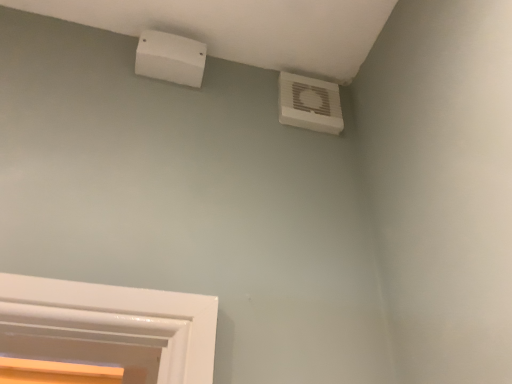
The height and width of the screenshot is (384, 512). Describe the element at coordinates (170, 58) in the screenshot. I see `white plastic air conditioning at upper left, which appears as the 1th air conditioning when viewed from the left` at that location.

Where is `white plastic air conditioning at upper left, which is the 2th air conditioning in right-to-left order`? Image resolution: width=512 pixels, height=384 pixels. white plastic air conditioning at upper left, which is the 2th air conditioning in right-to-left order is located at coordinates (170, 58).

Measure the distance between white plastic air conditioning at upper left, which is the 2th air conditioning in right-to-left order, and camera.

white plastic air conditioning at upper left, which is the 2th air conditioning in right-to-left order, and camera are 92.25 centimeters apart from each other.

The height and width of the screenshot is (384, 512). What do you see at coordinates (309, 104) in the screenshot?
I see `white plastic air conditioning unit at upper right, positioned as the second air conditioning in left-to-right order` at bounding box center [309, 104].

At what (x,y) coordinates should I click in order to perform the action: click on white plastic air conditioning unit at upper right, positioned as the second air conditioning in left-to-right order. Please return your answer as a coordinate pair (x, y). The height and width of the screenshot is (384, 512). Looking at the image, I should click on (309, 104).

The width and height of the screenshot is (512, 384). In order to click on white plastic air conditioning at upper left, which appears as the 1th air conditioning when viewed from the left in this screenshot , I will do `click(170, 58)`.

Considering the positions of objects white plastic air conditioning unit at upper right, positioned as the second air conditioning in left-to-right order, and white plastic air conditioning at upper left, which is the 2th air conditioning in right-to-left order, in the image provided, who is more to the right, white plastic air conditioning unit at upper right, positioned as the second air conditioning in left-to-right order, or white plastic air conditioning at upper left, which is the 2th air conditioning in right-to-left order,?

From the viewer's perspective, white plastic air conditioning unit at upper right, positioned as the second air conditioning in left-to-right order, appears more on the right side.

Relative to white plastic air conditioning at upper left, which appears as the 1th air conditioning when viewed from the left, is white plastic air conditioning unit at upper right, which is the 1th air conditioning from right to left, in front or behind?

In the image, white plastic air conditioning unit at upper right, which is the 1th air conditioning from right to left, appears behind white plastic air conditioning at upper left, which appears as the 1th air conditioning when viewed from the left.

In the scene shown: Which is less distant, (282,105) or (159,39)?

The point (159,39) is closer to the camera.

From the image's perspective, is white plastic air conditioning unit at upper right, positioned as the second air conditioning in left-to-right order, under white plastic air conditioning at upper left, which is the 2th air conditioning in right-to-left order?

Indeed, from the image's perspective, white plastic air conditioning unit at upper right, positioned as the second air conditioning in left-to-right order, is shown beneath white plastic air conditioning at upper left, which is the 2th air conditioning in right-to-left order.

From a real-world perspective, is white plastic air conditioning unit at upper right, which is the 1th air conditioning from right to left, physically located above or below white plastic air conditioning at upper left, which is the 2th air conditioning in right-to-left order?

In terms of real-world spatial position, white plastic air conditioning unit at upper right, which is the 1th air conditioning from right to left, is below white plastic air conditioning at upper left, which is the 2th air conditioning in right-to-left order.

Based on the photo, considering the relative sizes of white plastic air conditioning unit at upper right, which is the 1th air conditioning from right to left, and white plastic air conditioning at upper left, which is the 2th air conditioning in right-to-left order, in the image provided, is white plastic air conditioning unit at upper right, which is the 1th air conditioning from right to left, wider than white plastic air conditioning at upper left, which is the 2th air conditioning in right-to-left order,?

In fact, white plastic air conditioning unit at upper right, which is the 1th air conditioning from right to left, might be narrower than white plastic air conditioning at upper left, which is the 2th air conditioning in right-to-left order.

Considering the sizes of objects white plastic air conditioning unit at upper right, which is the 1th air conditioning from right to left, and white plastic air conditioning at upper left, which is the 2th air conditioning in right-to-left order, in the image provided, who is shorter, white plastic air conditioning unit at upper right, which is the 1th air conditioning from right to left, or white plastic air conditioning at upper left, which is the 2th air conditioning in right-to-left order,?

white plastic air conditioning at upper left, which is the 2th air conditioning in right-to-left order.

Considering the relative sizes of white plastic air conditioning unit at upper right, which is the 1th air conditioning from right to left, and white plastic air conditioning at upper left, which is the 2th air conditioning in right-to-left order, in the image provided, is white plastic air conditioning unit at upper right, which is the 1th air conditioning from right to left, bigger than white plastic air conditioning at upper left, which is the 2th air conditioning in right-to-left order,?

Incorrect, white plastic air conditioning unit at upper right, which is the 1th air conditioning from right to left, is not larger than white plastic air conditioning at upper left, which is the 2th air conditioning in right-to-left order.

Based on the photo, is white plastic air conditioning at upper left, which appears as the 1th air conditioning when viewed from the left, inside white plastic air conditioning unit at upper right, positioned as the second air conditioning in left-to-right order?

No.

Are white plastic air conditioning unit at upper right, positioned as the second air conditioning in left-to-right order, and white plastic air conditioning at upper left, which is the 2th air conditioning in right-to-left order, far apart?

white plastic air conditioning unit at upper right, positioned as the second air conditioning in left-to-right order, is actually quite close to white plastic air conditioning at upper left, which is the 2th air conditioning in right-to-left order.

Could you tell me if white plastic air conditioning unit at upper right, which is the 1th air conditioning from right to left, is turned towards white plastic air conditioning at upper left, which appears as the 1th air conditioning when viewed from the left?

No, white plastic air conditioning unit at upper right, which is the 1th air conditioning from right to left, is not turned towards white plastic air conditioning at upper left, which appears as the 1th air conditioning when viewed from the left.

How many degrees apart are the facing directions of white plastic air conditioning unit at upper right, positioned as the second air conditioning in left-to-right order, and white plastic air conditioning at upper left, which is the 2th air conditioning in right-to-left order?

They differ by 0.588 degrees in their facing directions.

Measure the distance between white plastic air conditioning unit at upper right, which is the 1th air conditioning from right to left, and white plastic air conditioning at upper left, which is the 2th air conditioning in right-to-left order.

white plastic air conditioning unit at upper right, which is the 1th air conditioning from right to left, is 10.43 inches away from white plastic air conditioning at upper left, which is the 2th air conditioning in right-to-left order.

The width and height of the screenshot is (512, 384). Find the location of `air conditioning below the white plastic air conditioning at upper left, which appears as the 1th air conditioning when viewed from the left (from a real-world perspective)`. air conditioning below the white plastic air conditioning at upper left, which appears as the 1th air conditioning when viewed from the left (from a real-world perspective) is located at coordinates pyautogui.click(x=309, y=104).

Is white plastic air conditioning at upper left, which is the 2th air conditioning in right-to-left order, to the left of white plastic air conditioning unit at upper right, which is the 1th air conditioning from right to left, from the viewer's perspective?

Yes, white plastic air conditioning at upper left, which is the 2th air conditioning in right-to-left order, is to the left of white plastic air conditioning unit at upper right, which is the 1th air conditioning from right to left.

In the image, is white plastic air conditioning at upper left, which appears as the 1th air conditioning when viewed from the left, positioned in front of or behind white plastic air conditioning unit at upper right, positioned as the second air conditioning in left-to-right order?

Visually, white plastic air conditioning at upper left, which appears as the 1th air conditioning when viewed from the left, is located in front of white plastic air conditioning unit at upper right, positioned as the second air conditioning in left-to-right order.

Which is behind, point (143, 48) or point (318, 116)?

The point (318, 116) is more distant.

From the image's perspective, is white plastic air conditioning at upper left, which is the 2th air conditioning in right-to-left order, under white plastic air conditioning unit at upper right, positioned as the second air conditioning in left-to-right order?

No, from the image's perspective, white plastic air conditioning at upper left, which is the 2th air conditioning in right-to-left order, is not below white plastic air conditioning unit at upper right, positioned as the second air conditioning in left-to-right order.

From a real-world perspective, is white plastic air conditioning at upper left, which appears as the 1th air conditioning when viewed from the left, physically above white plastic air conditioning unit at upper right, which is the 1th air conditioning from right to left?

Yes, from a real-world perspective, white plastic air conditioning at upper left, which appears as the 1th air conditioning when viewed from the left, is above white plastic air conditioning unit at upper right, which is the 1th air conditioning from right to left.

Which of these two, white plastic air conditioning at upper left, which is the 2th air conditioning in right-to-left order, or white plastic air conditioning unit at upper right, which is the 1th air conditioning from right to left, is thinner?

With smaller width is white plastic air conditioning unit at upper right, which is the 1th air conditioning from right to left.

Can you confirm if white plastic air conditioning at upper left, which is the 2th air conditioning in right-to-left order, is taller than white plastic air conditioning unit at upper right, positioned as the second air conditioning in left-to-right order?

No.

Which of these two, white plastic air conditioning at upper left, which appears as the 1th air conditioning when viewed from the left, or white plastic air conditioning unit at upper right, positioned as the second air conditioning in left-to-right order, is smaller?

Smaller between the two is white plastic air conditioning unit at upper right, positioned as the second air conditioning in left-to-right order.

Would you say white plastic air conditioning at upper left, which appears as the 1th air conditioning when viewed from the left, is outside white plastic air conditioning unit at upper right, which is the 1th air conditioning from right to left?

Yes, white plastic air conditioning at upper left, which appears as the 1th air conditioning when viewed from the left, is located beyond the bounds of white plastic air conditioning unit at upper right, which is the 1th air conditioning from right to left.

Is white plastic air conditioning at upper left, which is the 2th air conditioning in right-to-left order, in contact with white plastic air conditioning unit at upper right, which is the 1th air conditioning from right to left?

white plastic air conditioning at upper left, which is the 2th air conditioning in right-to-left order, and white plastic air conditioning unit at upper right, which is the 1th air conditioning from right to left, are clearly separated.

Is white plastic air conditioning at upper left, which appears as the 1th air conditioning when viewed from the left, turned away from white plastic air conditioning unit at upper right, which is the 1th air conditioning from right to left?

No.

Can you tell me how much white plastic air conditioning at upper left, which appears as the 1th air conditioning when viewed from the left, and white plastic air conditioning unit at upper right, positioned as the second air conditioning in left-to-right order, differ in facing direction?

0.588 degrees separate the facing orientations of white plastic air conditioning at upper left, which appears as the 1th air conditioning when viewed from the left, and white plastic air conditioning unit at upper right, positioned as the second air conditioning in left-to-right order.

Could you measure the distance between white plastic air conditioning at upper left, which appears as the 1th air conditioning when viewed from the left, and white plastic air conditioning unit at upper right, positioned as the second air conditioning in left-to-right order?

The distance of white plastic air conditioning at upper left, which appears as the 1th air conditioning when viewed from the left, from white plastic air conditioning unit at upper right, positioned as the second air conditioning in left-to-right order, is 10.43 inches.

The width and height of the screenshot is (512, 384). In order to click on air conditioning above the white plastic air conditioning unit at upper right, positioned as the second air conditioning in left-to-right order (from the image's perspective) in this screenshot , I will do `click(170, 58)`.

You are a GUI agent. You are given a task and a screenshot of the screen. Output one action in this format:
    pyautogui.click(x=<x>, y=<y>)
    Task: Click on the air conditioning on the right of white plastic air conditioning at upper left, which is the 2th air conditioning in right-to-left order
    
    Given the screenshot: What is the action you would take?
    pyautogui.click(x=309, y=104)

The height and width of the screenshot is (384, 512). Identify the location of air conditioning above the white plastic air conditioning unit at upper right, positioned as the second air conditioning in left-to-right order (from a real-world perspective). (170, 58).